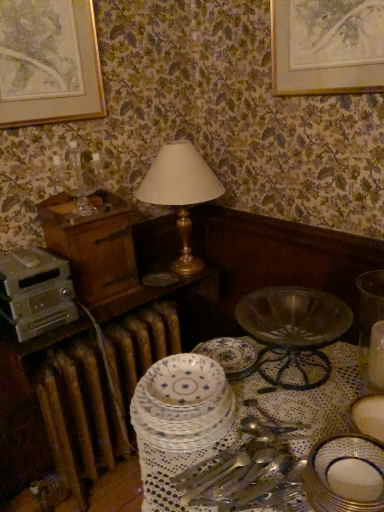
Where is `free point above porcelain bowl at center (from a real-world perspective)`? This screenshot has width=384, height=512. free point above porcelain bowl at center (from a real-world perspective) is located at coordinates (279, 413).